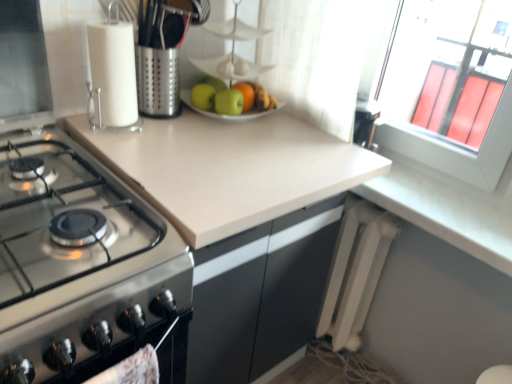
Question: Are beige laminate countertop at center and stainless steel gas stove at left making contact?

Choices:
 (A) yes
 (B) no

Answer: (B)

Question: Does beige laminate countertop at center have a greater height compared to stainless steel gas stove at left?

Choices:
 (A) yes
 (B) no

Answer: (A)

Question: From a real-world perspective, is beige laminate countertop at center beneath stainless steel gas stove at left?

Choices:
 (A) yes
 (B) no

Answer: (A)

Question: Is beige laminate countertop at center bigger than stainless steel gas stove at left?

Choices:
 (A) yes
 (B) no

Answer: (A)

Question: Considering the relative sizes of beige laminate countertop at center and stainless steel gas stove at left in the image provided, is beige laminate countertop at center thinner than stainless steel gas stove at left?

Choices:
 (A) no
 (B) yes

Answer: (B)

Question: From a real-world perspective, is beige laminate countertop at center located higher than stainless steel gas stove at left?

Choices:
 (A) no
 (B) yes

Answer: (A)

Question: Is stainless steel gas stove at left positioned beyond the bounds of beige laminate countertop at center?

Choices:
 (A) no
 (B) yes

Answer: (B)

Question: From the image's perspective, does stainless steel gas stove at left appear lower than beige laminate countertop at center?

Choices:
 (A) yes
 (B) no

Answer: (B)

Question: Is stainless steel gas stove at left beside beige laminate countertop at center?

Choices:
 (A) yes
 (B) no

Answer: (B)

Question: Can you confirm if stainless steel gas stove at left is shorter than beige laminate countertop at center?

Choices:
 (A) yes
 (B) no

Answer: (A)

Question: Does stainless steel gas stove at left have a greater width compared to beige laminate countertop at center?

Choices:
 (A) yes
 (B) no

Answer: (A)

Question: From a real-world perspective, is stainless steel gas stove at left below beige laminate countertop at center?

Choices:
 (A) yes
 (B) no

Answer: (B)

Question: Is green matte apple at center, which is the 1th apple from right to left, turned away from green matte apple at center, the first apple when ordered from left to right?

Choices:
 (A) no
 (B) yes

Answer: (B)